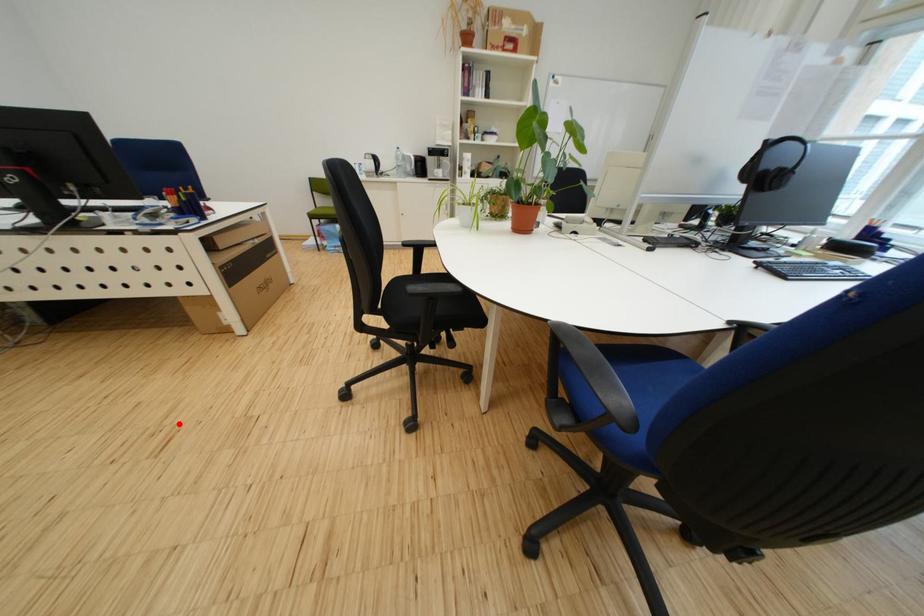
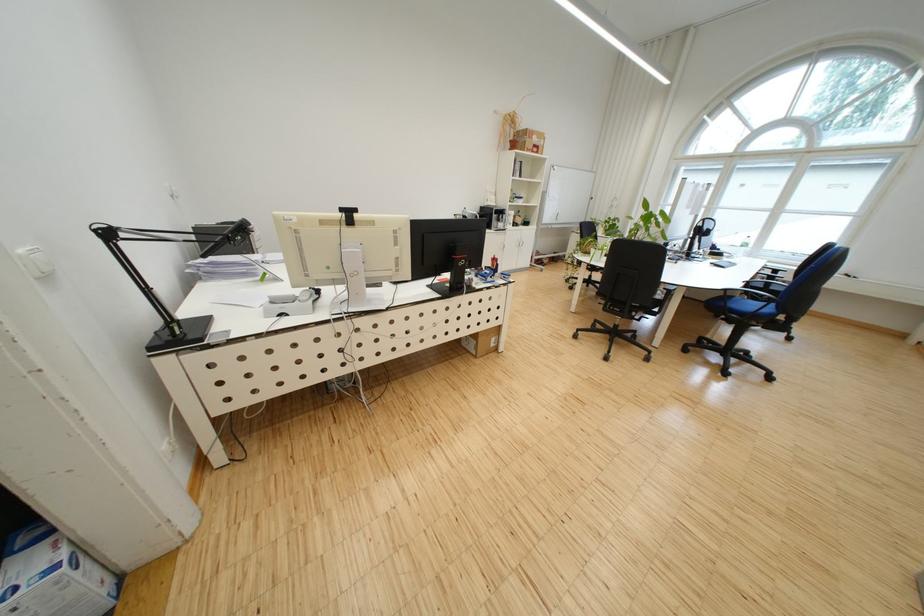
Where in the second image is the point corresponding to the highlighted location from the first image?

(572, 395)